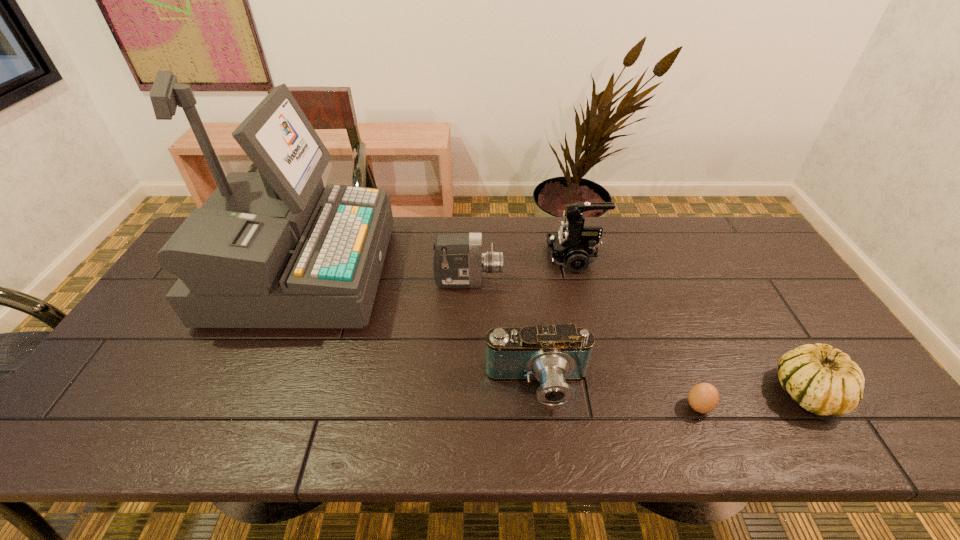
The image size is (960, 540). What are the coordinates of `object positioned at the far left corner` in the screenshot? It's located at (271, 249).

The height and width of the screenshot is (540, 960). In order to click on object situated at the near right corner in this screenshot , I will do `click(823, 380)`.

At what (x,y) coordinates should I click in order to perform the action: click on vacant space at the far edge of the desktop. Please return your answer as a coordinate pair (x, y). The height and width of the screenshot is (540, 960). Looking at the image, I should click on coord(693,255).

This screenshot has width=960, height=540. I want to click on vacant point at the near edge, so click(383, 415).

Locate an element on the screen. Image resolution: width=960 pixels, height=540 pixels. free space at the left edge of the desktop is located at coordinates [148, 376].

The height and width of the screenshot is (540, 960). In order to click on vacant space at the right edge of the desktop in this screenshot , I will do `click(755, 281)`.

At what (x,y) coordinates should I click in order to perform the action: click on free space at the far right corner of the desktop. Please return your answer as a coordinate pair (x, y). This screenshot has height=540, width=960. Looking at the image, I should click on (732, 245).

Where is `free space between the nearest camcorder and the leftmost object`? This screenshot has height=540, width=960. free space between the nearest camcorder and the leftmost object is located at coordinates (419, 329).

Locate an element on the screen. This screenshot has width=960, height=540. empty space between the nearest camcorder and the second tallest object is located at coordinates (556, 322).

At what (x,y) coordinates should I click in order to perform the action: click on empty location between the rightmost object and the nearest camcorder. Please return your answer as a coordinate pair (x, y). This screenshot has width=960, height=540. Looking at the image, I should click on (672, 389).